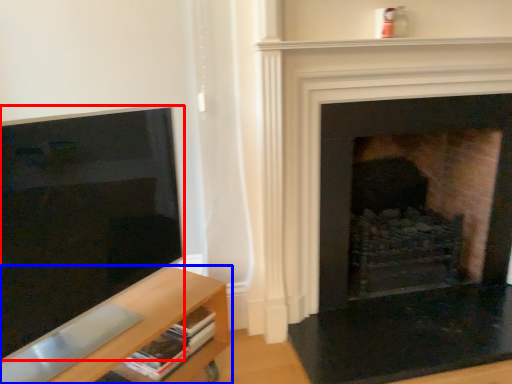
Question: Which object is closer to the camera taking this photo, screen (highlighted by a red box) or shelf (highlighted by a blue box)?

Choices:
 (A) screen
 (B) shelf

Answer: (A)